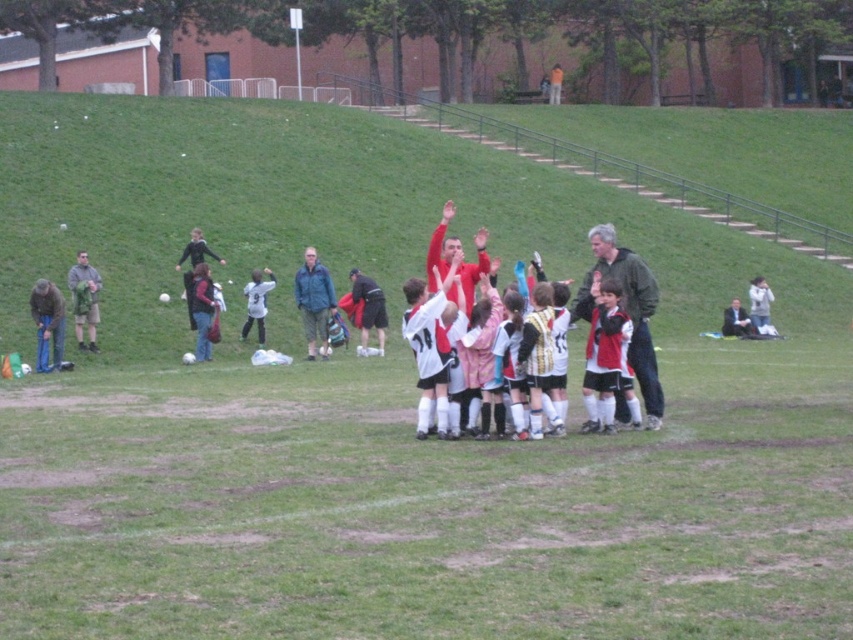
Question: Does red matte soccer team at center have a larger size compared to green camouflage jacket at left?

Choices:
 (A) no
 (B) yes

Answer: (B)

Question: Which of the following is the farthest from the observer?

Choices:
 (A) (257, 272)
 (B) (206, 314)
 (C) (86, 264)

Answer: (A)

Question: Does blue fabric jacket at center have a smaller size compared to dark gray hoodie at center?

Choices:
 (A) yes
 (B) no

Answer: (B)

Question: Which of the following is the closest to the observer?

Choices:
 (A) blue fabric jacket at center
 (B) gray-green jacket at center
 (C) green camouflage jacket at left

Answer: (B)

Question: Based on their relative distances, which object is nearer to the dark blue jacket at center?

Choices:
 (A) dark gray hoodie at center
 (B) dark gray suit at lower right
 (C) matte gray jacket at left
 (D) white jersey at center

Answer: (D)

Question: Can you confirm if matte gray jacket at left is smaller than dark blue jacket at center?

Choices:
 (A) yes
 (B) no

Answer: (B)